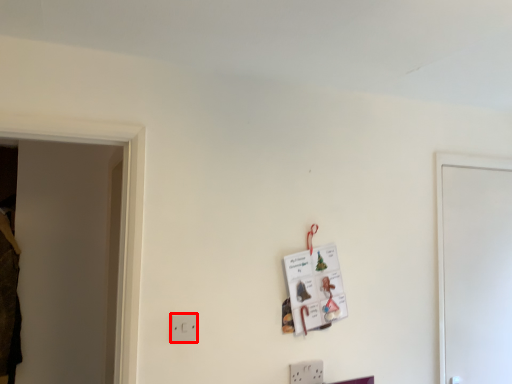
Question: From the image, what is the correct spatial relationship of light switch (annotated by the red box) in relation to door?

Choices:
 (A) left
 (B) right

Answer: (A)